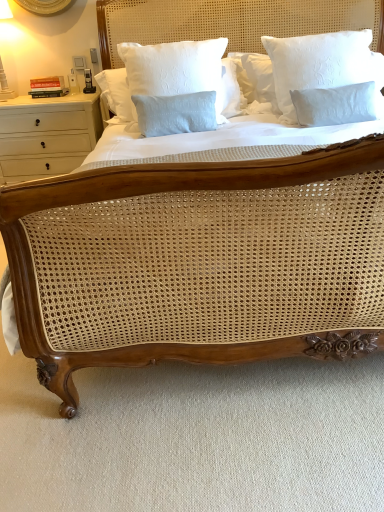
How much space does white textured pillow at upper right, which is counted as the 2th pillow, starting from the left, occupy vertically?

The height of white textured pillow at upper right, which is counted as the 2th pillow, starting from the left, is 28.11 inches.

What is the approximate width of light blue cotton pillow at center, the 1th pillow positioned from the left?

The width of light blue cotton pillow at center, the 1th pillow positioned from the left, is 5.62 inches.

You are a GUI agent. You are given a task and a screenshot of the screen. Output one action in this format:
    pyautogui.click(x=<x>, y=<y>)
    Task: Click on the light blue cotton pillow at center, the 1th pillow positioned from the left
    Image resolution: width=384 pixels, height=512 pixels.
    Given the screenshot: What is the action you would take?
    point(175,69)

The height and width of the screenshot is (512, 384). What are the coordinates of `white textured pillow at upper right, which ranks as the 1th pillow in right-to-left order` in the screenshot? It's located at (319, 64).

Between light blue cotton pillow at center, the 1th pillow positioned from the left, and white textured pillow at upper right, which ranks as the 1th pillow in right-to-left order, which one has larger width?

white textured pillow at upper right, which ranks as the 1th pillow in right-to-left order.

Is light blue cotton pillow at center, which appears as the second pillow when viewed from the right, not within white textured pillow at upper right, which ranks as the 1th pillow in right-to-left order?

That's correct, light blue cotton pillow at center, which appears as the second pillow when viewed from the right, is outside of white textured pillow at upper right, which ranks as the 1th pillow in right-to-left order.

You are a GUI agent. You are given a task and a screenshot of the screen. Output one action in this format:
    pyautogui.click(x=<x>, y=<y>)
    Task: Click on the pillow below the white textured pillow at upper right, which is counted as the 2th pillow, starting from the left (from a real-world perspective)
    The width and height of the screenshot is (384, 512).
    Given the screenshot: What is the action you would take?
    pyautogui.click(x=175, y=69)

Which of these two, light blue cotton pillow at center, the 1th pillow positioned from the left, or white wood drawer at left, is bigger?

white wood drawer at left is bigger.

Does light blue cotton pillow at center, which appears as the second pillow when viewed from the right, have a greater width compared to white wood drawer at left?

Incorrect, the width of light blue cotton pillow at center, which appears as the second pillow when viewed from the right, does not surpass that of white wood drawer at left.

Is light blue cotton pillow at center, the 1th pillow positioned from the left, at the right side of white wood drawer at left?

Indeed, light blue cotton pillow at center, the 1th pillow positioned from the left, is positioned on the right side of white wood drawer at left.

Is point (170, 86) positioned before point (5, 181)?

Yes.

From a real-world perspective, between white textured pillow at upper right, which is counted as the 2th pillow, starting from the left, and light blue cotton pillow at center, which appears as the second pillow when viewed from the right, who is vertically lower?

In real-world perspective, light blue cotton pillow at center, which appears as the second pillow when viewed from the right, is lower.

Between white textured pillow at upper right, which is counted as the 2th pillow, starting from the left, and light blue cotton pillow at center, the 1th pillow positioned from the left, which one has smaller width?

light blue cotton pillow at center, the 1th pillow positioned from the left.

In the scene shown: Is the position of white textured pillow at upper right, which ranks as the 1th pillow in right-to-left order, less distant than that of light blue cotton pillow at center, which appears as the second pillow when viewed from the right?

That is True.

Is white wood drawer at left spatially inside white textured pillow at upper right, which is counted as the 2th pillow, starting from the left, or outside of it?

The correct answer is: outside.

Looking at this image, looking at their sizes, would you say white wood drawer at left is wider or thinner than white textured pillow at upper right, which is counted as the 2th pillow, starting from the left?

Considering their sizes, white wood drawer at left looks broader than white textured pillow at upper right, which is counted as the 2th pillow, starting from the left.

Is white wood drawer at left far from white textured pillow at upper right, which is counted as the 2th pillow, starting from the left?

Yes.

From the image's perspective, is white wood drawer at left over white textured pillow at upper right, which ranks as the 1th pillow in right-to-left order?

No, from the image's perspective, white wood drawer at left is not on top of white textured pillow at upper right, which ranks as the 1th pillow in right-to-left order.

Would you consider white wood drawer at left to be distant from light blue cotton pillow at center, the 1th pillow positioned from the left?

No, white wood drawer at left is in close proximity to light blue cotton pillow at center, the 1th pillow positioned from the left.

Does white wood drawer at left have a lesser height compared to light blue cotton pillow at center, which appears as the second pillow when viewed from the right?

Incorrect, the height of white wood drawer at left does not fall short of that of light blue cotton pillow at center, which appears as the second pillow when viewed from the right.

Consider the image. Which is more to the left, white wood drawer at left or light blue cotton pillow at center, the 1th pillow positioned from the left?

From the viewer's perspective, white wood drawer at left appears more on the left side.

Considering the positions of objects white textured pillow at upper right, which is counted as the 2th pillow, starting from the left, and white wood drawer at left in the image provided, who is more to the left, white textured pillow at upper right, which is counted as the 2th pillow, starting from the left, or white wood drawer at left?

From the viewer's perspective, white wood drawer at left appears more on the left side.

Is white textured pillow at upper right, which is counted as the 2th pillow, starting from the left, positioned before white wood drawer at left?

Yes, white textured pillow at upper right, which is counted as the 2th pillow, starting from the left, is closer to the viewer.

Considering the positions of point (280, 45) and point (51, 129), is point (280, 45) closer or farther from the camera than point (51, 129)?

Point (280, 45) is positioned closer to the camera compared to point (51, 129).

From a real-world perspective, is white textured pillow at upper right, which is counted as the 2th pillow, starting from the left, over white wood drawer at left?

Correct, in the physical world, white textured pillow at upper right, which is counted as the 2th pillow, starting from the left, is higher than white wood drawer at left.

Where is `pillow that appears behind the white textured pillow at upper right, which ranks as the 1th pillow in right-to-left order`? This screenshot has height=512, width=384. pillow that appears behind the white textured pillow at upper right, which ranks as the 1th pillow in right-to-left order is located at coordinates (175, 69).

Image resolution: width=384 pixels, height=512 pixels. In the image, there is a light blue cotton pillow at center, which appears as the second pillow when viewed from the right. What are the coordinates of `nightstand below it (from a real-world perspective)` in the screenshot? It's located at (47, 135).

Which object lies nearer to the anchor point white textured pillow at upper right, which ranks as the 1th pillow in right-to-left order, white wood drawer at left or light blue cotton pillow at center, which appears as the second pillow when viewed from the right?

The object closer to white textured pillow at upper right, which ranks as the 1th pillow in right-to-left order, is light blue cotton pillow at center, which appears as the second pillow when viewed from the right.

Based on their spatial positions, is white wood drawer at left or white textured pillow at upper right, which ranks as the 1th pillow in right-to-left order, further from light blue cotton pillow at center, which appears as the second pillow when viewed from the right?

Among the two, white wood drawer at left is located further to light blue cotton pillow at center, which appears as the second pillow when viewed from the right.

Based on their spatial positions, is light blue cotton pillow at center, which appears as the second pillow when viewed from the right, or white textured pillow at upper right, which ranks as the 1th pillow in right-to-left order, closer to white wood drawer at left?

light blue cotton pillow at center, which appears as the second pillow when viewed from the right, is closer to white wood drawer at left.

Based on the photo, from the image, which object appears to be farther from light blue cotton pillow at center, which appears as the second pillow when viewed from the right, white textured pillow at upper right, which ranks as the 1th pillow in right-to-left order, or white wood drawer at left?

white wood drawer at left.

Considering their positions, is white textured pillow at upper right, which is counted as the 2th pillow, starting from the left, positioned closer to white wood drawer at left than light blue cotton pillow at center, the 1th pillow positioned from the left?

Based on the image, light blue cotton pillow at center, the 1th pillow positioned from the left, appears to be nearer to white wood drawer at left.

When comparing their distances from white textured pillow at upper right, which is counted as the 2th pillow, starting from the left, does light blue cotton pillow at center, which appears as the second pillow when viewed from the right, or white wood drawer at left seem closer?

light blue cotton pillow at center, which appears as the second pillow when viewed from the right, is closer to white textured pillow at upper right, which is counted as the 2th pillow, starting from the left.

The image size is (384, 512). Find the location of `pillow situated between white wood drawer at left and white textured pillow at upper right, which ranks as the 1th pillow in right-to-left order, from left to right`. pillow situated between white wood drawer at left and white textured pillow at upper right, which ranks as the 1th pillow in right-to-left order, from left to right is located at coordinates (175, 69).